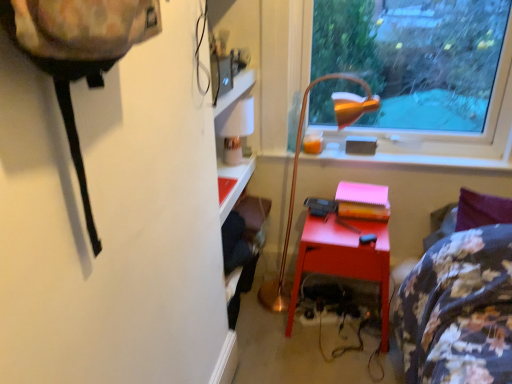
Question: Should I look upward or downward to see matte red desk at center?

Choices:
 (A) down
 (B) up

Answer: (A)

Question: Is matte red desk at center located within transparent glass window at upper right?

Choices:
 (A) yes
 (B) no

Answer: (B)

Question: Is transparent glass window at upper right next to matte red desk at center and touching it?

Choices:
 (A) no
 (B) yes

Answer: (A)

Question: Does transparent glass window at upper right appear on the right side of matte red desk at center?

Choices:
 (A) yes
 (B) no

Answer: (A)

Question: Is transparent glass window at upper right at the left side of matte red desk at center?

Choices:
 (A) yes
 (B) no

Answer: (B)

Question: Considering the relative sizes of transparent glass window at upper right and matte red desk at center in the image provided, is transparent glass window at upper right shorter than matte red desk at center?

Choices:
 (A) yes
 (B) no

Answer: (B)

Question: Is transparent glass window at upper right closer to the viewer compared to matte red desk at center?

Choices:
 (A) yes
 (B) no

Answer: (A)

Question: From the image's perspective, is matte orange lampshade at upper center above matte red desk at center?

Choices:
 (A) yes
 (B) no

Answer: (A)

Question: Is matte orange lampshade at upper center positioned in front of matte red desk at center?

Choices:
 (A) yes
 (B) no

Answer: (B)

Question: Is matte orange lampshade at upper center directly adjacent to matte red desk at center?

Choices:
 (A) yes
 (B) no

Answer: (B)

Question: Does matte orange lampshade at upper center have a smaller size compared to matte red desk at center?

Choices:
 (A) yes
 (B) no

Answer: (A)

Question: Considering the relative positions of matte orange lampshade at upper center and matte red desk at center in the image provided, is matte orange lampshade at upper center to the right of matte red desk at center from the viewer's perspective?

Choices:
 (A) no
 (B) yes

Answer: (B)

Question: Can you confirm if matte orange lampshade at upper center is taller than matte red desk at center?

Choices:
 (A) no
 (B) yes

Answer: (A)

Question: Is transparent glass window at upper right not near gold metallic floor lamp at center?

Choices:
 (A) yes
 (B) no

Answer: (B)